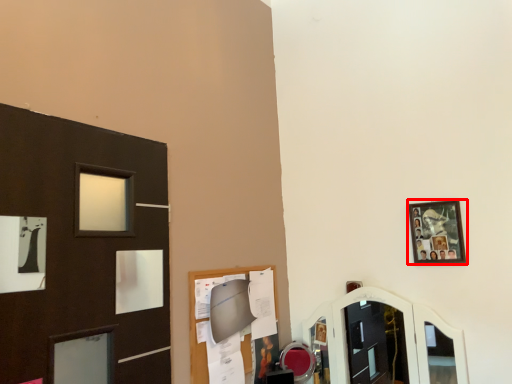
Question: Observing the image, what is the correct spatial positioning of picture frame (annotated by the red box) in reference to mirror?

Choices:
 (A) left
 (B) right

Answer: (B)